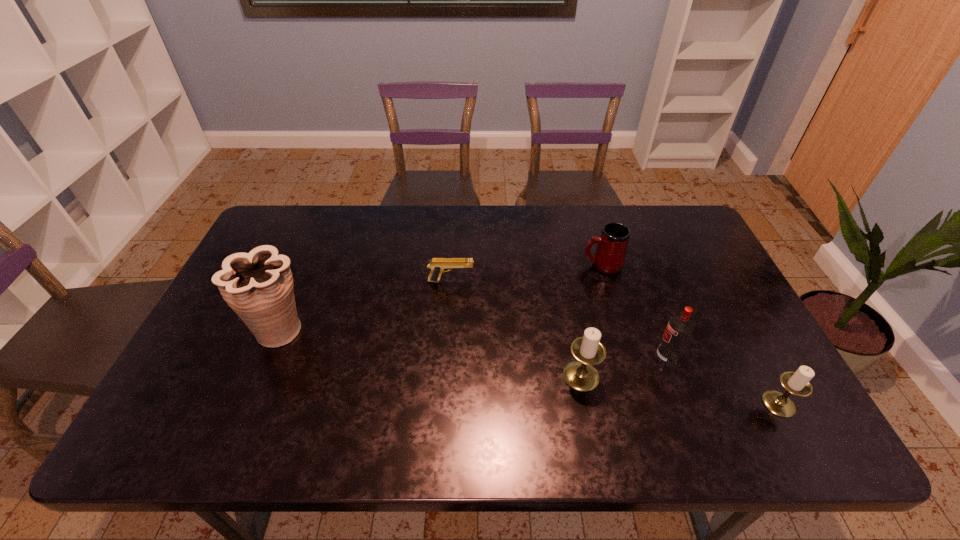
You are a GUI agent. You are given a task and a screenshot of the screen. Output one action in this format:
    pyautogui.click(x=<x>, y=<y>)
    Task: Click on the third object from left to right
    
    Given the screenshot: What is the action you would take?
    pyautogui.click(x=581, y=375)

What are the coordinates of `the left candle holder` in the screenshot? It's located at (581, 375).

You are a GUI agent. You are given a task and a screenshot of the screen. Output one action in this format:
    pyautogui.click(x=<x>, y=<y>)
    Task: Click on the shorter candle holder
    Image resolution: width=960 pixels, height=540 pixels.
    Given the screenshot: What is the action you would take?
    pyautogui.click(x=797, y=383)

I want to click on the rightmost object, so click(x=797, y=383).

Identify the location of the tallest object. The height and width of the screenshot is (540, 960). (258, 286).

I want to click on the leftmost object, so click(258, 286).

Identify the location of mug. (609, 257).

Image resolution: width=960 pixels, height=540 pixels. Find the location of `the fourth object from left to right`. the fourth object from left to right is located at coordinates (609, 257).

Find the location of a particular element. The height and width of the screenshot is (540, 960). vodka is located at coordinates (679, 328).

Find the location of `the fifth object from right to left`. the fifth object from right to left is located at coordinates [438, 266].